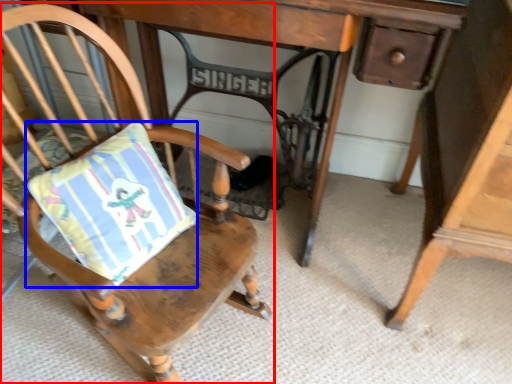
Question: Among these objects, which one is farthest to the camera, chair (highlighted by a red box) or pillow (highlighted by a blue box)?

Choices:
 (A) chair
 (B) pillow

Answer: (B)